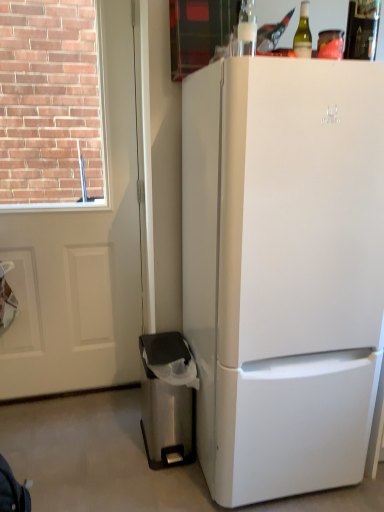
Question: From a real-world perspective, is stainless steel trash can at lower left over white matte refrigerator at right?

Choices:
 (A) yes
 (B) no

Answer: (B)

Question: From the image's perspective, is stainless steel trash can at lower left under white matte refrigerator at right?

Choices:
 (A) no
 (B) yes

Answer: (B)

Question: Is stainless steel trash can at lower left completely or partially outside of white matte refrigerator at right?

Choices:
 (A) yes
 (B) no

Answer: (A)

Question: Is stainless steel trash can at lower left looking in the opposite direction of white matte refrigerator at right?

Choices:
 (A) yes
 (B) no

Answer: (B)

Question: Does stainless steel trash can at lower left come behind white matte refrigerator at right?

Choices:
 (A) yes
 (B) no

Answer: (A)

Question: Is stainless steel trash can at lower left shorter than white matte refrigerator at right?

Choices:
 (A) no
 (B) yes

Answer: (B)

Question: From a real-world perspective, is white matte screen door at left on white matte refrigerator at right?

Choices:
 (A) yes
 (B) no

Answer: (A)

Question: Is white matte screen door at left taller than white matte refrigerator at right?

Choices:
 (A) no
 (B) yes

Answer: (B)

Question: Is white matte refrigerator at right at the back of white matte screen door at left?

Choices:
 (A) yes
 (B) no

Answer: (B)

Question: Can you confirm if white matte screen door at left is positioned to the left of white matte refrigerator at right?

Choices:
 (A) no
 (B) yes

Answer: (B)

Question: Considering the relative sizes of white matte screen door at left and white matte refrigerator at right in the image provided, is white matte screen door at left thinner than white matte refrigerator at right?

Choices:
 (A) no
 (B) yes

Answer: (B)

Question: Is white matte screen door at left oriented towards white matte refrigerator at right?

Choices:
 (A) yes
 (B) no

Answer: (B)

Question: Is stainless steel trash can at lower left smaller than white matte screen door at left?

Choices:
 (A) yes
 (B) no

Answer: (A)